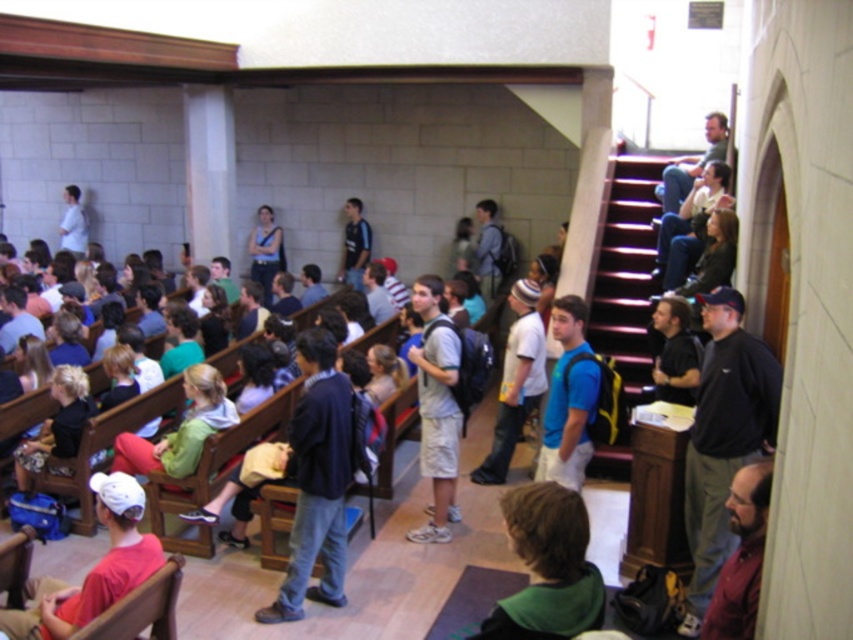
Question: Is the position of wooden stairs at upper right more distant than that of green fabric shirt at lower center?

Choices:
 (A) yes
 (B) no

Answer: (A)

Question: Does wooden stairs at upper right appear on the right side of matte red cap at lower left?

Choices:
 (A) no
 (B) yes

Answer: (B)

Question: Among these objects, which one is farthest from the camera?

Choices:
 (A) wooden stairs at upper right
 (B) green fabric shirt at lower center
 (C) blue fabric backpack at center
 (D) matte red cap at lower left

Answer: (A)

Question: Where is wooden stairs at upper right located in relation to matte red cap at lower left in the image?

Choices:
 (A) below
 (B) above

Answer: (B)

Question: Considering the real-world distances, which object is farthest from the blue fabric backpack at center?

Choices:
 (A) matte red cap at lower left
 (B) green fabric shirt at lower center
 (C) wooden stairs at upper right

Answer: (B)

Question: Which object is closer to the camera taking this photo?

Choices:
 (A) blue fabric backpack at center
 (B) green fabric shirt at lower center
 (C) matte red cap at lower left

Answer: (B)